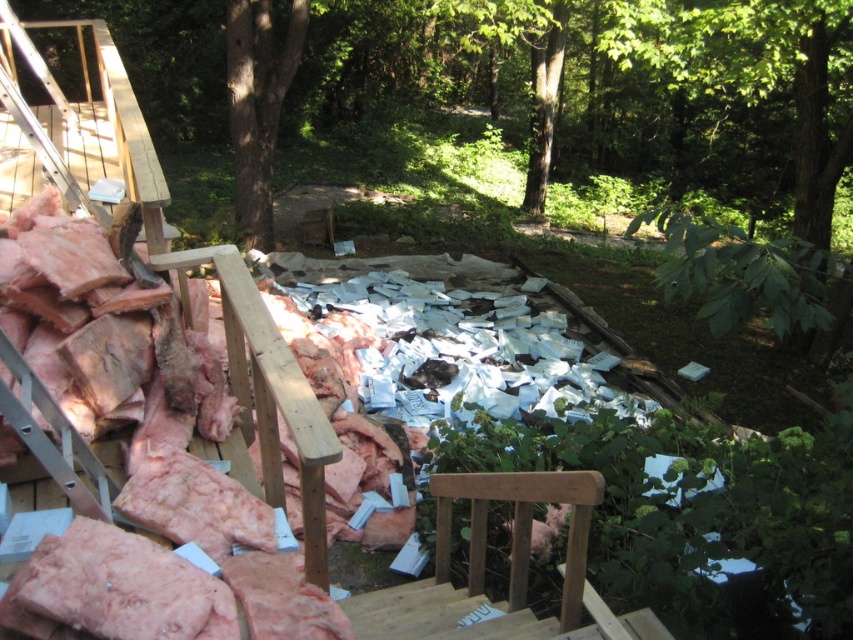
Looking at this image, you are standing at the bottom of the wooden staircase and want to move towards the two points marked in the scene. Which point, point (234, 220) or point (70, 120), is closer to you?

Point (70, 120) is closer to you because it is less further to the camera than point (234, 220).

You are standing at the base of the wooden staircase and want to reach the green leafy tree at center. Which direction should you head to from the staircase?

The green leafy tree at center is located at point [258,104], so you should head towards the center of the image from the staircase.